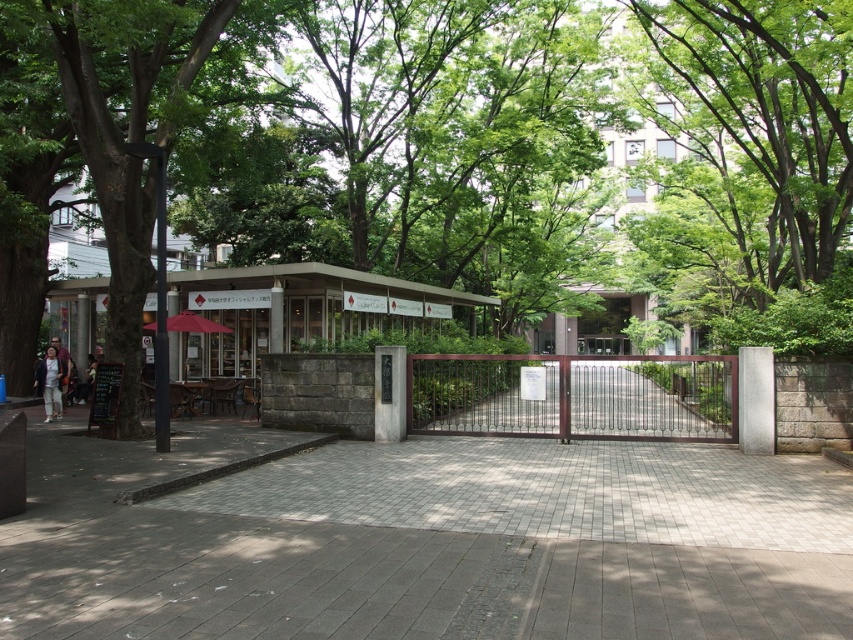
From the picture: You are standing on the paved pathway and want to take a photo of the light beige pants at left without the green leafy tree at center blocking the view. Is this possible?

The green leafy tree at center is above the light beige pants at left, so you can take a photo of the light beige pants at left without the tree blocking the view by positioning yourself below the tree or adjusting your angle to avoid the tree.

You are a visitor walking along the paved pathway towards the brown metal gate at center. As you approach, you notice the green leafy tree at center. Which object will you encounter first?

The green leafy tree at center is in front of the brown metal gate at center, so you will encounter the green leafy tree at center first as you walk towards the gate.

You are planning to walk from the gray brick pavement at center to the brown metal gate at center. Which object will you encounter first?

You will encounter the gray brick pavement at center first because it is smaller than the brown metal gate at center, meaning it is closer to your starting position.